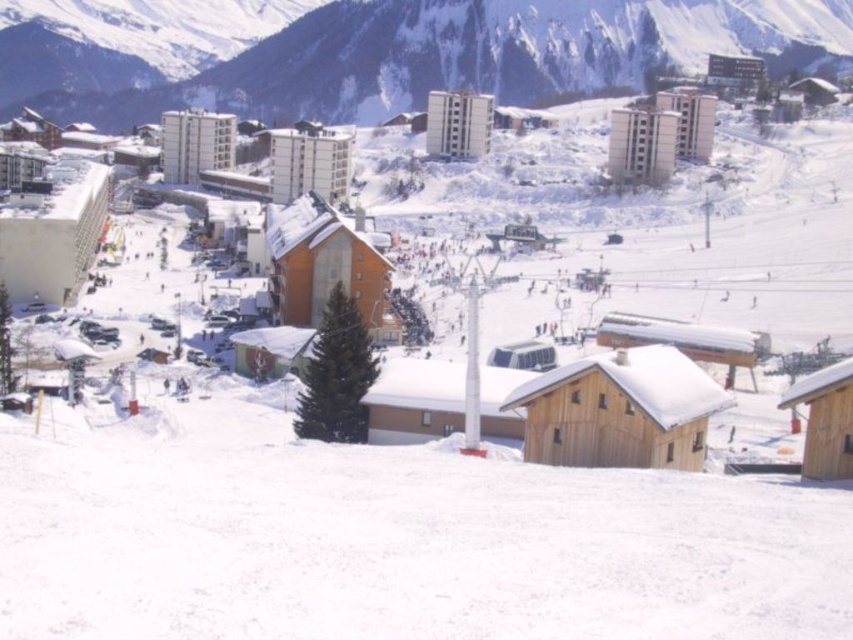
You are standing at the point with coordinates point (102, 74) and want to walk to the point with coordinates point (294, 538). According to the scene, which direction should you move to reach your destination?

You should move forward because point (294, 538) is in front of point (102, 74).

In the scene shown: You are a skier at the bottom of the slope and want to reach the ski lift located near the snowy mountain at upper center. Which direction should you move relative to the white snow at lower center to get there?

To reach the snowy mountain at upper center from the white snow at lower center, you should move to the left since the white snow at lower center is to the right of the snowy mountain at upper center.

You are a winter sports enthusiast planning to take a photo of the snowy mountain at upper center and the white snow at lower center. Which object should you focus on first if you want to capture both in a single frame without moving the camera?

You should focus on the snowy mountain at upper center first because it is larger than the white snow at lower center, ensuring it fits well within the frame while still capturing the smaller white snow at lower center in the foreground.